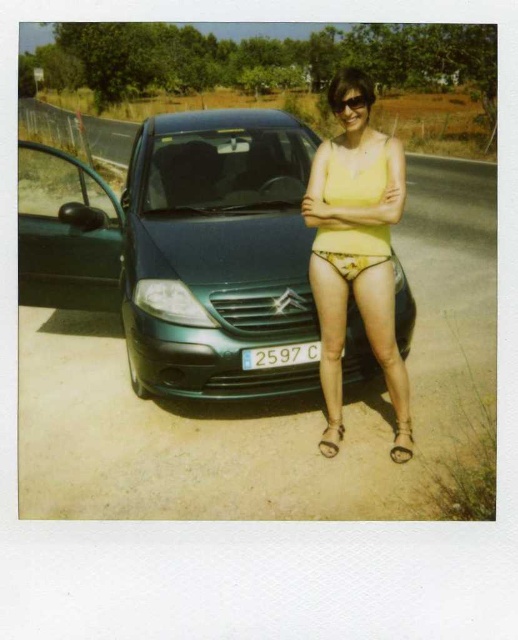
Question: Does yellow floral fabric bikini bottom at center appear on the left side of leather at front?

Choices:
 (A) no
 (B) yes

Answer: (A)

Question: Estimate the real-world distances between objects in this image. Which object is farther from the green metallic car at center?

Choices:
 (A) shiny black sunglasses at upper center
 (B) yellow floral fabric bikini bottom at center

Answer: (A)

Question: Which object appears closest to the camera in this image?

Choices:
 (A) white plastic license plate at center
 (B) leather at front
 (C) yellow matte bikini top at center

Answer: (C)

Question: Can you confirm if green metallic car at center is positioned to the right of shiny black sunglasses at upper center?

Choices:
 (A) yes
 (B) no

Answer: (B)

Question: Estimate the real-world distances between objects in this image. Which object is closer to the green metallic car at center?

Choices:
 (A) brown leather sandal at lower right
 (B) shiny black sunglasses at upper center
 (C) yellow matte bikini top at center

Answer: (C)

Question: Considering the relative positions of yellow matte tank top at center and shiny black sunglasses at upper center in the image provided, where is yellow matte tank top at center located with respect to shiny black sunglasses at upper center?

Choices:
 (A) right
 (B) left

Answer: (B)